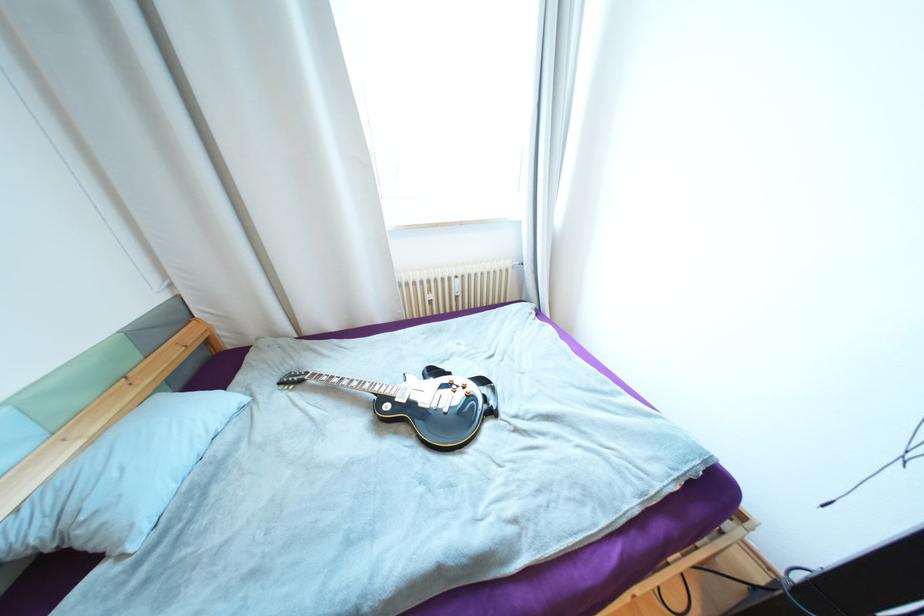
Describe the element at coordinates (337, 383) in the screenshot. This screenshot has width=924, height=616. I see `the guitar tuning key` at that location.